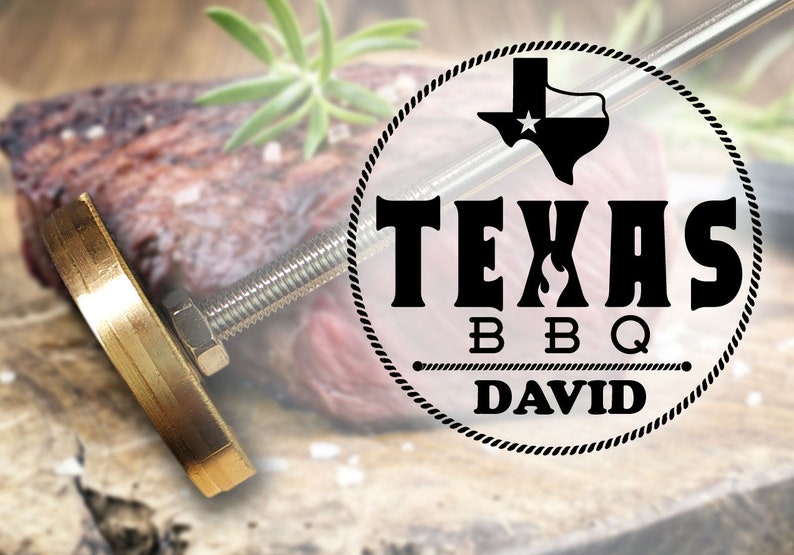
Identify the location of cutting board. (270, 519).